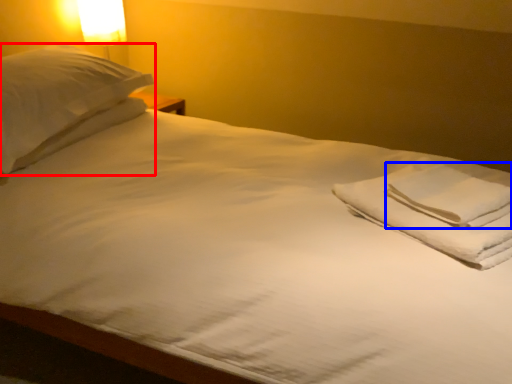
Question: Which point is closer to the camera, pillow (highlighted by a red box) or hand towel (highlighted by a blue box)?

Choices:
 (A) pillow
 (B) hand towel

Answer: (B)